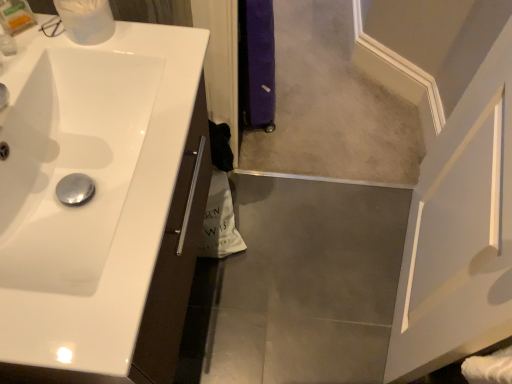
Question: Is white glossy sink at left oriented towards translucent plastic container at upper left?

Choices:
 (A) yes
 (B) no

Answer: (B)

Question: From the image's perspective, is white glossy sink at left below translucent plastic container at upper left?

Choices:
 (A) yes
 (B) no

Answer: (A)

Question: Is white glossy sink at left turned away from translucent plastic container at upper left?

Choices:
 (A) yes
 (B) no

Answer: (B)

Question: Considering the relative positions of white glossy sink at left and translucent plastic container at upper left in the image provided, is white glossy sink at left to the right of translucent plastic container at upper left from the viewer's perspective?

Choices:
 (A) no
 (B) yes

Answer: (B)

Question: Can you confirm if white glossy sink at left is positioned to the left of translucent plastic container at upper left?

Choices:
 (A) yes
 (B) no

Answer: (B)

Question: In the image, is translucent plastic container at upper left positioned in front of or behind beige carpet at center?

Choices:
 (A) front
 (B) behind

Answer: (A)

Question: Considering the positions of translucent plastic container at upper left and beige carpet at center in the image, is translucent plastic container at upper left bigger or smaller than beige carpet at center?

Choices:
 (A) big
 (B) small

Answer: (B)

Question: From the image's perspective, is translucent plastic container at upper left located above or below beige carpet at center?

Choices:
 (A) above
 (B) below

Answer: (B)

Question: In the image, is translucent plastic container at upper left on the left side or the right side of beige carpet at center?

Choices:
 (A) right
 (B) left

Answer: (B)

Question: Is point (326, 107) closer or farther from the camera than point (11, 29)?

Choices:
 (A) farther
 (B) closer

Answer: (A)

Question: Would you say beige carpet at center is inside or outside translucent plastic container at upper left?

Choices:
 (A) inside
 (B) outside

Answer: (B)

Question: From their relative heights in the image, would you say beige carpet at center is taller or shorter than translucent plastic container at upper left?

Choices:
 (A) short
 (B) tall

Answer: (A)

Question: From a real-world perspective, relative to translucent plastic container at upper left, is beige carpet at center vertically above or below?

Choices:
 (A) above
 (B) below

Answer: (B)

Question: Considering the relative positions of white glossy sink at left and translucent plastic container at upper left in the image provided, is white glossy sink at left to the left or to the right of translucent plastic container at upper left?

Choices:
 (A) left
 (B) right

Answer: (B)

Question: From a real-world perspective, is white glossy sink at left positioned above or below translucent plastic container at upper left?

Choices:
 (A) above
 (B) below

Answer: (B)